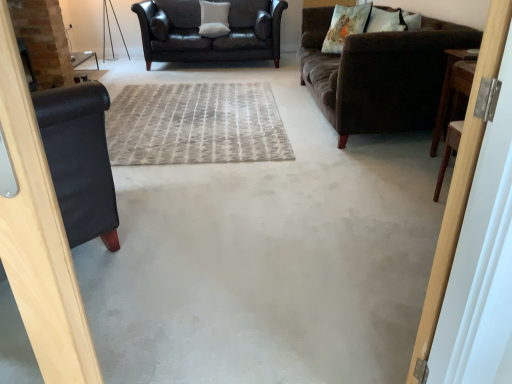
I want to click on free spot to the left of brown wooden table at right, so click(x=414, y=163).